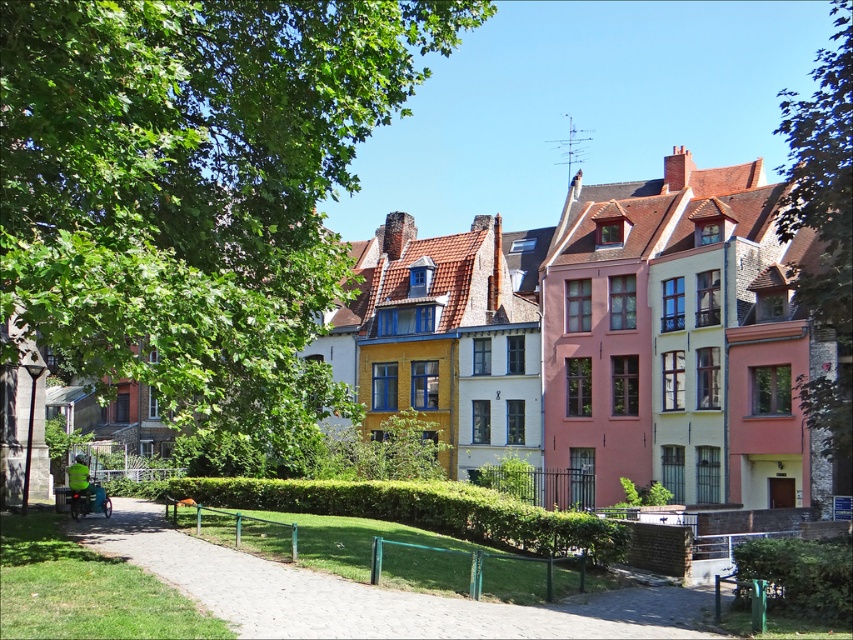
Question: Estimate the real-world distances between objects in this image. Which object is farther from the green leafy tree at right?

Choices:
 (A) smooth concrete path at lower left
 (B) green leafy tree at upper left

Answer: (A)

Question: Which of the following is the farthest from the observer?

Choices:
 (A) green leafy tree at right
 (B) smooth concrete path at lower left
 (C) green leafy tree at upper left

Answer: (A)

Question: Does green leafy tree at upper left have a larger size compared to smooth concrete path at lower left?

Choices:
 (A) yes
 (B) no

Answer: (A)

Question: Does green leafy tree at upper left have a larger size compared to green leafy tree at right?

Choices:
 (A) no
 (B) yes

Answer: (A)

Question: Observing the image, what is the correct spatial positioning of green leafy tree at upper left in reference to smooth concrete path at lower left?

Choices:
 (A) left
 (B) right

Answer: (A)

Question: Estimate the real-world distances between objects in this image. Which object is closer to the smooth concrete path at lower left?

Choices:
 (A) green leafy tree at right
 (B) green leafy tree at upper left

Answer: (B)